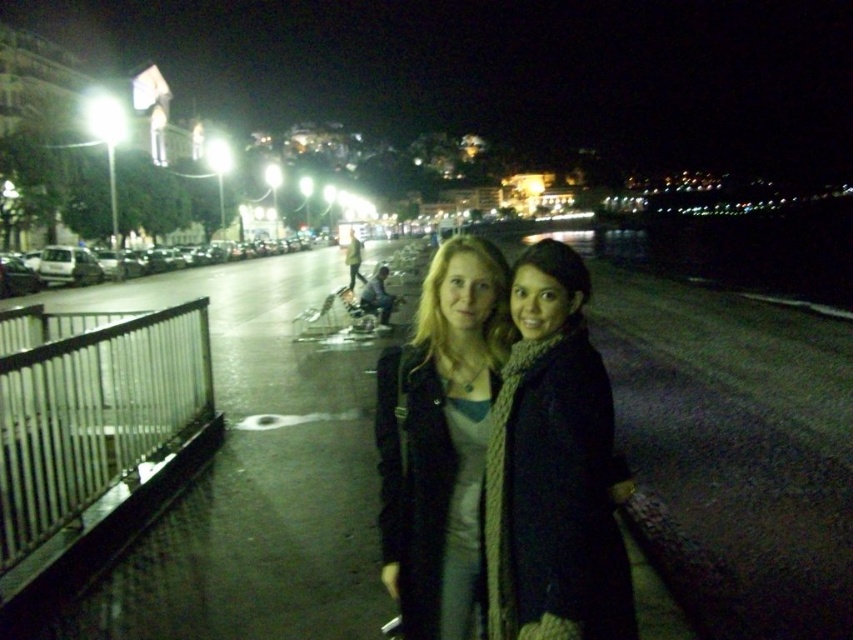
You are a photographer trying to capture the two people in the scene. The knitted beige scarf at center and the knitted scarf at center are both visible in your shot. Which scarf appears wider in the photo?

The knitted beige scarf at center appears wider than the knitted scarf at center because its width surpasses the other.

You are a photographer trying to capture the two people in the scene. You notice the knitted beige scarf at center and the knitted scarf at center. Which scarf is positioned to the right of the other?

The knitted beige scarf at center is positioned to the right of the knitted scarf at center.